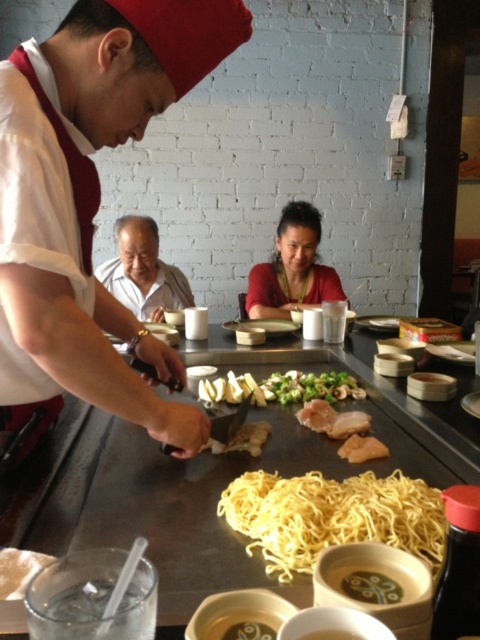
Question: Which is nearer to the smooth white soup at lower center?

Choices:
 (A) shiny stainless steel table at center
 (B) matte red blouse at center
 (C) yellow matte noodles at center
 (D) brown crispy chicken at center

Answer: (C)

Question: Can you confirm if yellow matte noodles at center is thinner than matte red blouse at center?

Choices:
 (A) yes
 (B) no

Answer: (A)

Question: Can you confirm if matte red blouse at center is smaller than smooth white soup at lower center?

Choices:
 (A) no
 (B) yes

Answer: (A)

Question: Considering the relative positions of green leafy vegetables at center and smooth white soup at lower center in the image provided, where is green leafy vegetables at center located with respect to smooth white soup at lower center?

Choices:
 (A) below
 (B) above

Answer: (B)

Question: Which of the following is the closest to the observer?

Choices:
 (A) yellow matte noodles at center
 (B) shiny stainless steel table at center
 (C) brown crispy chicken at center
 (D) translucent glass bowl at lower center

Answer: (D)

Question: Based on their relative distances, which object is farther from the white shirt at center?

Choices:
 (A) smooth white soup at lower center
 (B) green leafy vegetables at center
 (C) shiny stainless steel table at center
 (D) brown crispy chicken at center

Answer: (A)